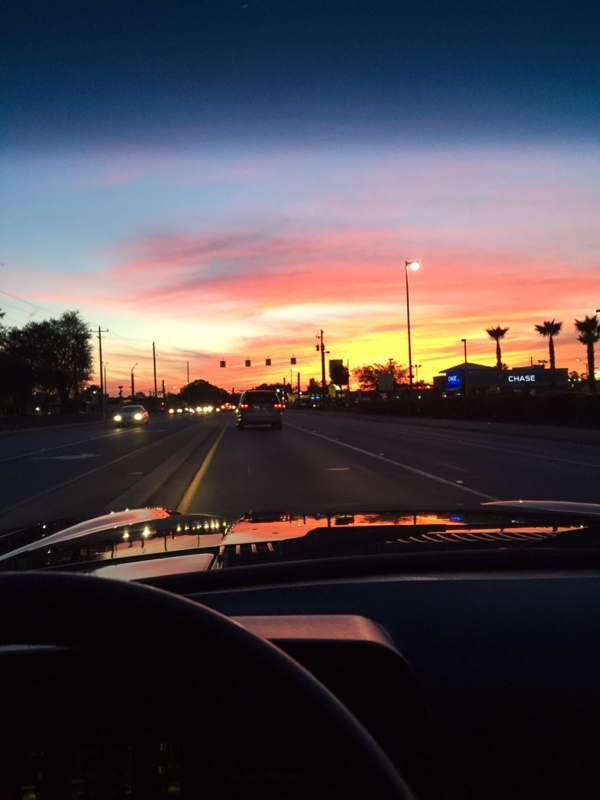
Locate an element on the screen. The height and width of the screenshot is (800, 600). hood is located at coordinates (323, 506).